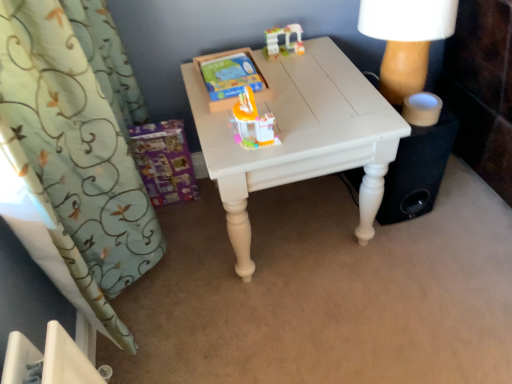
Question: Is translucent plastic toy at center, which is the 1th toy from bottom to top, positioned beyond the bounds of translucent plastic building at upper center, placed as the first toy when sorted from back to front?

Choices:
 (A) yes
 (B) no

Answer: (A)

Question: Is translucent plastic toy at center, the second toy when ordered from back to front, far away from translucent plastic building at upper center, placed as the first toy when sorted from back to front?

Choices:
 (A) no
 (B) yes

Answer: (A)

Question: Can you confirm if translucent plastic toy at center, arranged as the first toy when viewed from the front, is positioned to the left of translucent plastic building at upper center, which is counted as the 2th toy, starting from the bottom?

Choices:
 (A) no
 (B) yes

Answer: (B)

Question: Can you confirm if translucent plastic toy at center, the second toy when ordered from back to front, is positioned to the right of translucent plastic building at upper center, which is counted as the 2th toy, starting from the bottom?

Choices:
 (A) yes
 (B) no

Answer: (B)

Question: Is the depth of translucent plastic toy at center, the second toy when ordered from back to front, greater than that of translucent plastic building at upper center, which is counted as the 2th toy, starting from the bottom?

Choices:
 (A) yes
 (B) no

Answer: (B)

Question: Is translucent plastic toy at center, which is the 1th toy from bottom to top, turned away from translucent plastic building at upper center, marked as the 2th toy in a front-to-back arrangement?

Choices:
 (A) yes
 (B) no

Answer: (A)

Question: From a real-world perspective, is green floral fabric curtain at left positioned under white painted wood table at center based on gravity?

Choices:
 (A) yes
 (B) no

Answer: (B)

Question: Does green floral fabric curtain at left have a greater width compared to white painted wood table at center?

Choices:
 (A) no
 (B) yes

Answer: (A)

Question: From the image's perspective, is green floral fabric curtain at left beneath white painted wood table at center?

Choices:
 (A) no
 (B) yes

Answer: (A)

Question: Is green floral fabric curtain at left outside white painted wood table at center?

Choices:
 (A) no
 (B) yes

Answer: (B)

Question: Is white painted wood table at center at the back of green floral fabric curtain at left?

Choices:
 (A) yes
 (B) no

Answer: (B)

Question: Considering the relative sizes of green floral fabric curtain at left and white painted wood table at center in the image provided, is green floral fabric curtain at left smaller than white painted wood table at center?

Choices:
 (A) yes
 (B) no

Answer: (B)

Question: Is white painted wood table at center touching translucent plastic building at upper center, which is counted as the 2th toy, starting from the bottom?

Choices:
 (A) no
 (B) yes

Answer: (A)